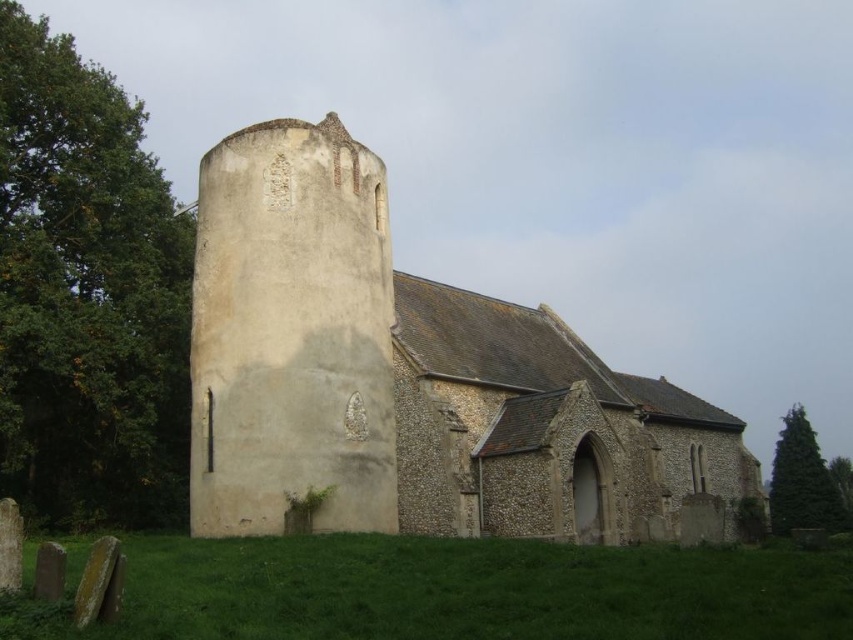
Based on the photo, who is lower down, beige stone church at center or green grass at lower center?

green grass at lower center

Does beige stone church at center have a greater width compared to green grass at lower center?

No, beige stone church at center is not wider than green grass at lower center.

Where is `beige stone church at center`? The height and width of the screenshot is (640, 853). beige stone church at center is located at coordinates (409, 378).